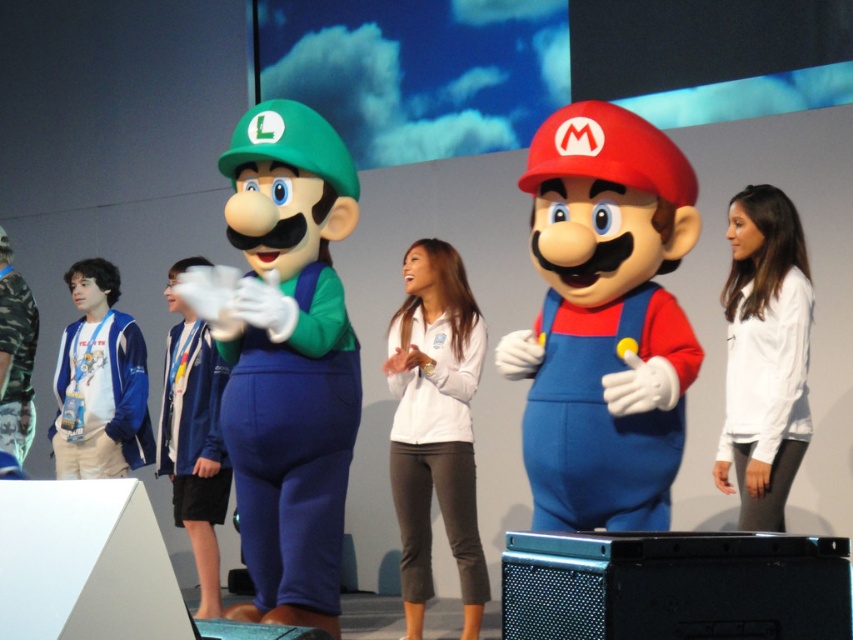
Is white matte jacket at center to the left of camo fabric shirt at left from the viewer's perspective?

Incorrect, white matte jacket at center is not on the left side of camo fabric shirt at left.

What do you see at coordinates (434, 426) in the screenshot?
I see `white matte jacket at center` at bounding box center [434, 426].

Is point (450, 428) behind point (10, 317)?

No, it is not.

The image size is (853, 640). I want to click on white matte jacket at center, so click(434, 426).

Can you confirm if white matte shirt at center is smaller than camo fabric shirt at left?

Actually, white matte shirt at center might be larger than camo fabric shirt at left.

Which is behind, point (788, 444) or point (9, 339)?

The point (9, 339) is behind.

Where is `white matte shirt at center`? The height and width of the screenshot is (640, 853). white matte shirt at center is located at coordinates (764, 355).

Does matte plastic mario at center appear on the left side of camo fabric shirt at left?

Incorrect, matte plastic mario at center is not on the left side of camo fabric shirt at left.

Is matte plastic mario at center shorter than camo fabric shirt at left?

Incorrect, matte plastic mario at center's height does not fall short of camo fabric shirt at left's.

Does point (556, 280) lie behind point (24, 436)?

No, it is not.

You are a GUI agent. You are given a task and a screenshot of the screen. Output one action in this format:
    pyautogui.click(x=<x>, y=<y>)
    Task: Click on the matte plastic mario at center
    The height and width of the screenshot is (640, 853).
    Given the screenshot: What is the action you would take?
    pyautogui.click(x=604, y=321)